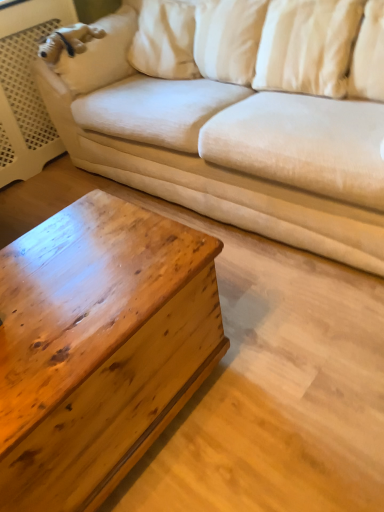
Question: Considering the relative sizes of beige fabric couch at upper center and white soft pillow at upper right, the first pillow viewed from the right, in the image provided, is beige fabric couch at upper center shorter than white soft pillow at upper right, the first pillow viewed from the right,?

Choices:
 (A) no
 (B) yes

Answer: (A)

Question: Does beige fabric couch at upper center have a greater height compared to white soft pillow at upper right, which ranks as the 2th pillow in left-to-right order?

Choices:
 (A) no
 (B) yes

Answer: (B)

Question: Can you confirm if beige fabric couch at upper center is positioned to the right of white soft pillow at upper right, which ranks as the 2th pillow in left-to-right order?

Choices:
 (A) no
 (B) yes

Answer: (A)

Question: Is beige fabric couch at upper center oriented towards white soft pillow at upper right, which ranks as the 2th pillow in left-to-right order?

Choices:
 (A) yes
 (B) no

Answer: (A)

Question: From a real-world perspective, is beige fabric couch at upper center positioned over white soft pillow at upper right, which ranks as the 2th pillow in left-to-right order, based on gravity?

Choices:
 (A) yes
 (B) no

Answer: (B)

Question: From their relative heights in the image, would you say beige fabric couch at upper center is taller or shorter than white soft pillow at upper right, the first pillow viewed from the right?

Choices:
 (A) tall
 (B) short

Answer: (A)

Question: Looking at the image, does beige fabric couch at upper center seem bigger or smaller compared to white soft pillow at upper right, the first pillow viewed from the right?

Choices:
 (A) big
 (B) small

Answer: (A)

Question: From the image's perspective, relative to white soft pillow at upper right, the first pillow viewed from the right, is beige fabric couch at upper center above or below?

Choices:
 (A) below
 (B) above

Answer: (B)

Question: Do you think beige fabric couch at upper center is within white soft pillow at upper right, the first pillow viewed from the right, or outside of it?

Choices:
 (A) inside
 (B) outside

Answer: (B)

Question: Is wooden chestnut coffee table at lower left in front of or behind white soft pillow at upper right, the first pillow viewed from the right, in the image?

Choices:
 (A) behind
 (B) front

Answer: (B)

Question: From the image's perspective, is wooden chestnut coffee table at lower left above or below white soft pillow at upper right, the first pillow viewed from the right?

Choices:
 (A) below
 (B) above

Answer: (A)

Question: Visually, is wooden chestnut coffee table at lower left positioned to the left or to the right of white soft pillow at upper right, which ranks as the 2th pillow in left-to-right order?

Choices:
 (A) left
 (B) right

Answer: (A)

Question: Is wooden chestnut coffee table at lower left taller or shorter than white soft pillow at upper right, which ranks as the 2th pillow in left-to-right order?

Choices:
 (A) short
 (B) tall

Answer: (B)

Question: In terms of height, does white soft pillow at upper right, the first pillow viewed from the right, look taller or shorter compared to wooden chestnut coffee table at lower left?

Choices:
 (A) tall
 (B) short

Answer: (B)

Question: Looking at their shapes, would you say white soft pillow at upper right, the first pillow viewed from the right, is wider or thinner than wooden chestnut coffee table at lower left?

Choices:
 (A) thin
 (B) wide

Answer: (A)